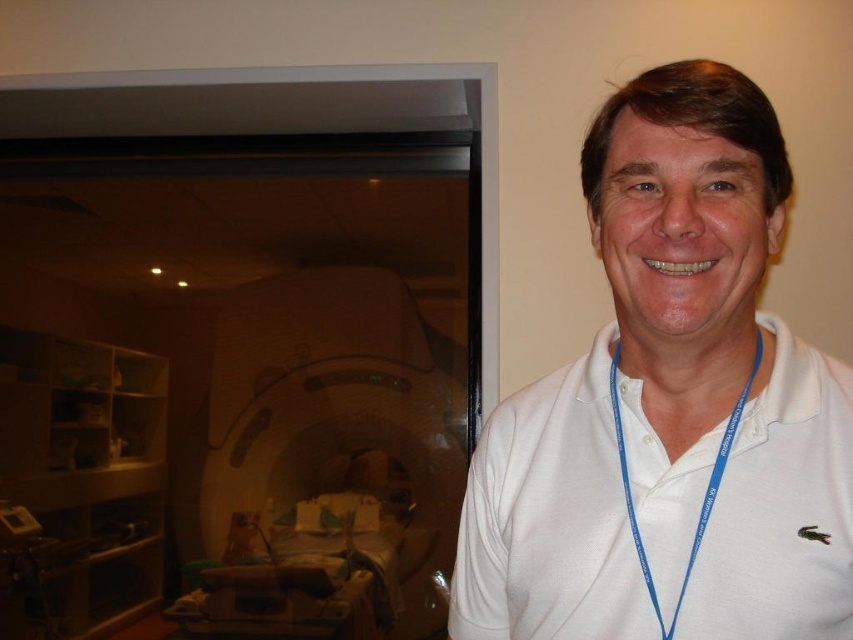
Is point (711, 134) behind point (669, 369)?

That is False.

Is white cotton polo shirt at center thinner than white smooth neck at center?

No.

Identify the location of white cotton polo shirt at center. This screenshot has width=853, height=640. click(670, 406).

At what (x,y) coordinates should I click in order to perform the action: click on white cotton polo shirt at center. Please return your answer as a coordinate pair (x, y). The image size is (853, 640). Looking at the image, I should click on (670, 406).

Does white cotton polo shirt at center come behind blue fabric lanyard at center?

No, white cotton polo shirt at center is in front of blue fabric lanyard at center.

Which of these two, white cotton polo shirt at center or blue fabric lanyard at center, stands shorter?

blue fabric lanyard at center is shorter.

Is point (813, 620) behind point (759, 353)?

That is False.

I want to click on white cotton polo shirt at center, so click(670, 406).

Does blue fabric lanyard at center appear on the right side of white smooth neck at center?

Incorrect, blue fabric lanyard at center is not on the right side of white smooth neck at center.

Which is behind, point (698, 522) or point (613, 355)?

Point (613, 355)

Who is more forward, (704, 492) or (662, 380)?

Point (704, 492)

Identify the location of blue fabric lanyard at center. (704, 492).